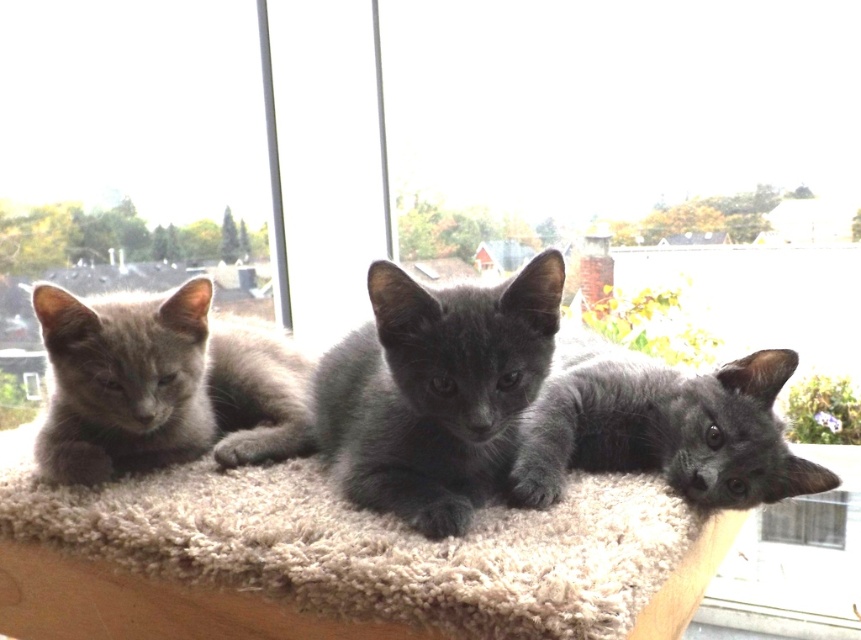
You are a cat owner who wants to ensure your kittens are safe from the cold outside. You see the shiny black kitten at center and the transparent glass window at lower right. Which kitten is closer to the window?

The shiny black kitten at center is to the left of the transparent glass window at lower right, so it is closer to the window than the other kittens not mentioned here.

You are a cat owner who wants to place a small toy between the three kittens resting on the soft beige carpet at center. How much space do you need to leave between the kittens to ensure the toy fits comfortably?

The three kittens resting on the soft beige carpet at center are 28.10 inches apart, so you should leave at least 28.10 inches of space between them to place the toy comfortably.

You are a cat owner who wants to place a new toy for your gray fluffy kitten at left. The toy requires a minimum of 20 cm of space to be placed safely. Based on the scene, can the soft beige carpet at center provide enough space for the toy?

The soft beige carpet at center has a width larger than the gray fluffy kitten at left. Since the kitten is on the carpet, the carpet must be wider than the kitten. However, without knowing the exact size of the kitten, we cannot determine if the carpet meets the 20 cm requirement. More information is needed.